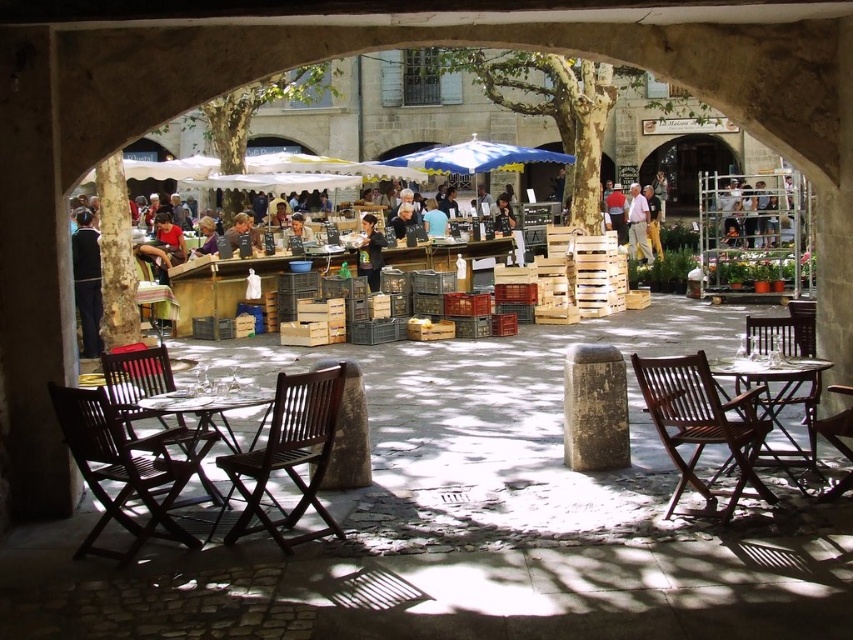
Image resolution: width=853 pixels, height=640 pixels. What do you see at coordinates (126, 467) in the screenshot?
I see `wooden chair at lower left` at bounding box center [126, 467].

Which is behind, point (119, 472) or point (84, 250)?

Positioned behind is point (84, 250).

Identify the location of wooden chair at lower left. This screenshot has height=640, width=853. (126, 467).

Image resolution: width=853 pixels, height=640 pixels. I want to click on wooden chair at lower left, so click(126, 467).

Does brown wooden chair at lower right have a greater width compared to light brown wooden chair at center?

No.

Looking at this image, does brown wooden chair at lower right appear under light brown wooden chair at center?

Yes.

Identify the location of brown wooden chair at lower right. (837, 429).

Can you confirm if wooden chair at lower left is taller than light brown wooden chair at center right?

In fact, wooden chair at lower left may be shorter than light brown wooden chair at center right.

Does point (167, 451) come behind point (755, 200)?

No, (167, 451) is in front of (755, 200).

Does point (167, 496) come in front of point (784, 211)?

Yes.

This screenshot has height=640, width=853. What are the coordinates of `wooden chair at lower left` in the screenshot? It's located at (126, 467).